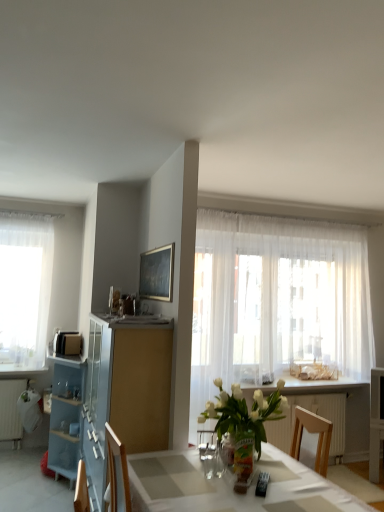
Question: From the image's perspective, is white glossy counter top at center located above or below clear glass vase at center?

Choices:
 (A) below
 (B) above

Answer: (A)

Question: Is white glossy counter top at center in front of or behind clear glass vase at center in the image?

Choices:
 (A) front
 (B) behind

Answer: (B)

Question: Based on their relative distances, which object is farther from the white glossy table at center?

Choices:
 (A) clear glass vase at center
 (B) white sheer curtain at left, the 2th curtain viewed from the right
 (C) matte black microwave at left
 (D) blue glass cabinet at left
 (E) white matte radiator at lower left, marked as the first radiator in a left-to-right arrangement

Answer: (B)

Question: Considering the real-world distances, which object is closest to the white matte radiator at lower left, which appears as the second radiator when viewed from the right?

Choices:
 (A) blue glass cabinet at left
 (B) matte black microwave at left
 (C) clear glass vase at center
 (D) white glass vase at center
 (E) white glossy counter top at center

Answer: (B)